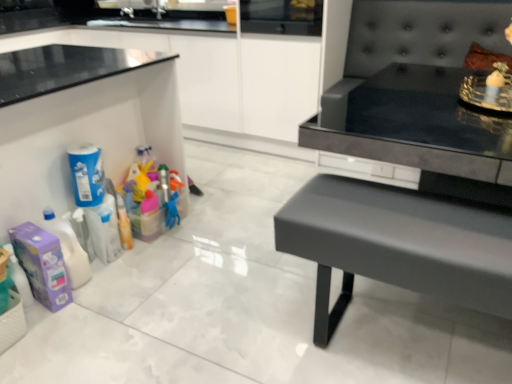
Question: From a real-world perspective, is white woven basket at lower left above or below matte black bench at right?

Choices:
 (A) below
 (B) above

Answer: (A)

Question: Is white woven basket at lower left wider or thinner than matte black bench at right?

Choices:
 (A) wide
 (B) thin

Answer: (B)

Question: Which is farther from the white woven basket at lower left?

Choices:
 (A) matte black bench at right
 (B) blue matte cleaning product at left, which appears as the 1th cleaning product when viewed from the top
 (C) white glossy cabinetry at upper left
 (D) purple cardboard box at lower left, which is the 1th cleaning product from bottom to top

Answer: (C)

Question: Which object is the farthest from the white woven basket at lower left?

Choices:
 (A) matte black bench at right
 (B) blue matte cleaning product at left, which appears as the 1th cleaning product when viewed from the top
 (C) white glossy cabinetry at upper left
 (D) purple cardboard box at lower left, which is the 1th cleaning product from bottom to top

Answer: (C)